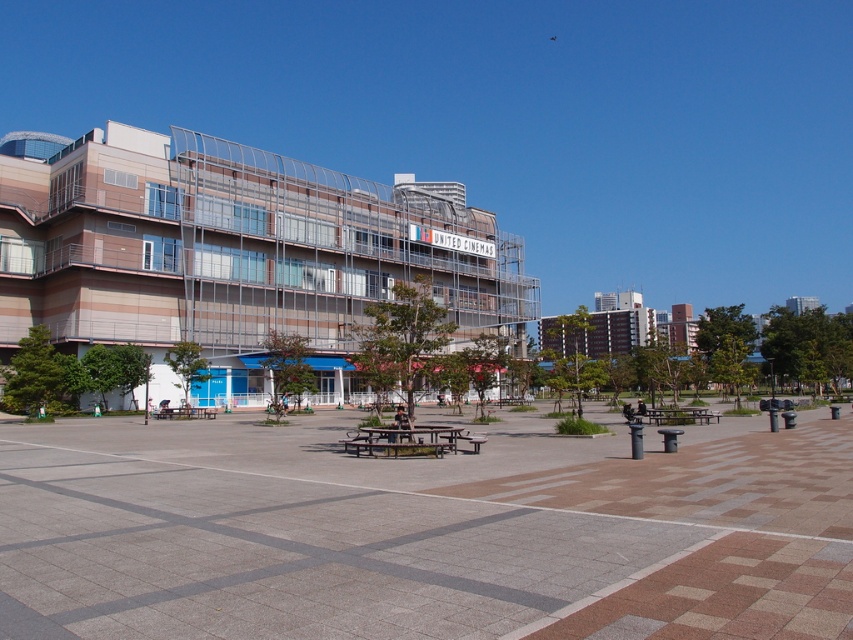
You are a maintenance worker needing to move a 5 meter long equipment from the concrete paving at center to the wooden picnic table at center. Can you move it without bending or shortening the equipment?

The distance between the concrete paving at center and the wooden picnic table at center is 4.78 meters, which is shorter than the 5 meter length of the equipment. Therefore, you cannot move it without bending or shortening the equipment.

You are planning to place a new bench in the plaza. The bench you have is the same size as the wooden picnic table at center. Based on the scene, can the bench be placed on the concrete paving at center without overlapping?

The concrete paving at center has a larger size compared to the wooden picnic table at center. Since the bench is the same size as the picnic table, it should fit on the concrete paving without overlapping, provided there is enough space.